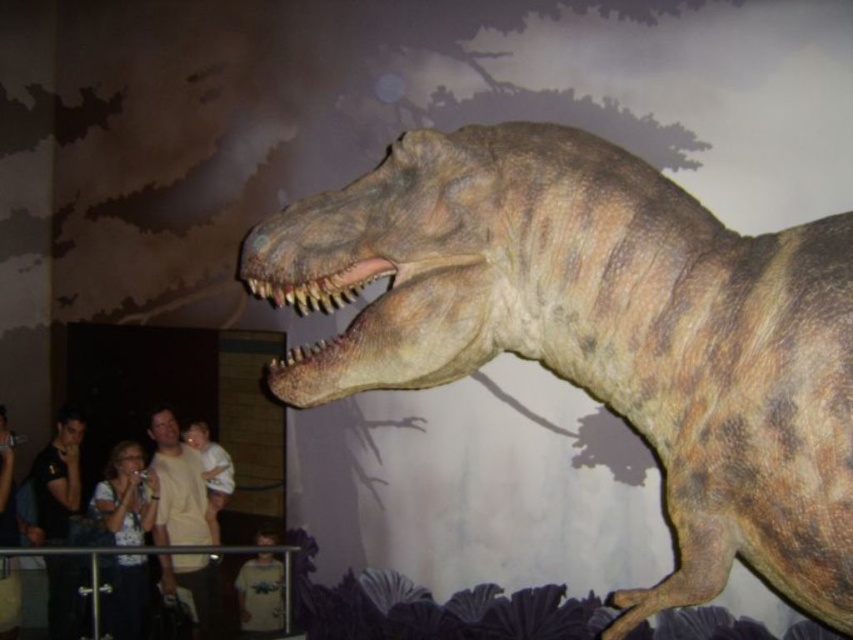
Question: Which of these objects is positioned farthest from the light brown t-shirt at left?

Choices:
 (A) black t-shirt at left
 (B) white cotton shirt at lower left
 (C) light beige shirt at lower left
 (D) light brown fabric shirt at lower left

Answer: (D)

Question: Which of these objects is positioned farthest from the light beige shirt at lower left?

Choices:
 (A) rough textured brown dinosaur at center
 (B) light brown fabric shirt at lower left
 (C) light brown t-shirt at left
 (D) white cotton shirt at lower left

Answer: (A)

Question: Is black t-shirt at left below light beige shirt at lower left?

Choices:
 (A) no
 (B) yes

Answer: (A)

Question: Does light brown t-shirt at left appear over light brown t-shirt at lower center?

Choices:
 (A) no
 (B) yes

Answer: (B)

Question: Is light brown t-shirt at left smaller than light brown fabric shirt at lower left?

Choices:
 (A) no
 (B) yes

Answer: (A)

Question: Which of the following is the farthest from the observer?

Choices:
 (A) (776, 477)
 (B) (59, 515)
 (C) (195, 600)
 (D) (96, 508)

Answer: (B)